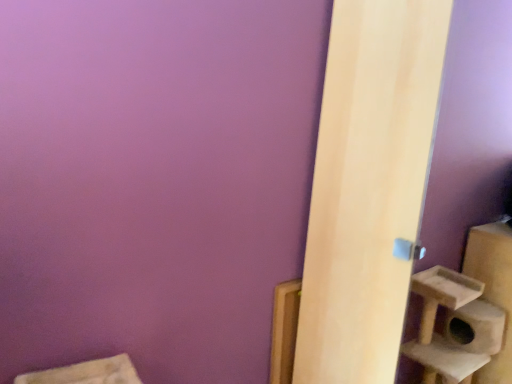
Question: Considering the positions of light wood door at right and wooden frame at lower right in the image, is light wood door at right wider or thinner than wooden frame at lower right?

Choices:
 (A) wide
 (B) thin

Answer: (A)

Question: In the image, is light wood door at right on the left side or the right side of wooden frame at lower right?

Choices:
 (A) left
 (B) right

Answer: (B)

Question: From their relative heights in the image, would you say light wood door at right is taller or shorter than wooden frame at lower right?

Choices:
 (A) short
 (B) tall

Answer: (B)

Question: Relative to light wood door at right, is wooden frame at lower right in front or behind?

Choices:
 (A) front
 (B) behind

Answer: (B)

Question: Considering the positions of wooden frame at lower right and light wood door at right in the image, is wooden frame at lower right bigger or smaller than light wood door at right?

Choices:
 (A) small
 (B) big

Answer: (A)

Question: Is wooden frame at lower right to the left or to the right of light wood door at right in the image?

Choices:
 (A) right
 (B) left

Answer: (B)

Question: Is wooden frame at lower right taller or shorter than light wood door at right?

Choices:
 (A) tall
 (B) short

Answer: (B)